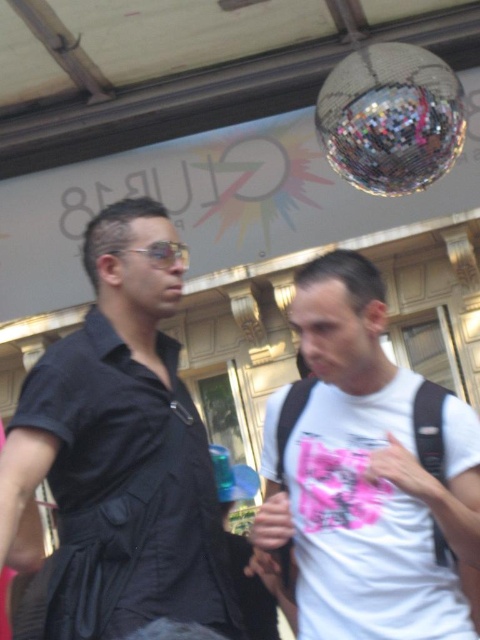
Who is more forward, (360, 525) or (385, 77)?

Point (360, 525) is more forward.

Which is more to the right, white matte t-shirt at center or reflective metallic disco ball at upper center?

Positioned to the right is reflective metallic disco ball at upper center.

Is point (396, 460) farther from camera compared to point (393, 128)?

No, (396, 460) is in front of (393, 128).

At what (x,y) coordinates should I click in order to perform the action: click on white matte t-shirt at center. Please return your answer as a coordinate pair (x, y). The height and width of the screenshot is (640, 480). Looking at the image, I should click on (367, 474).

Is black matte shirt at left below reflective metallic disco ball at upper center?

Yes, black matte shirt at left is below reflective metallic disco ball at upper center.

Between black matte shirt at left and reflective metallic disco ball at upper center, which one has less height?

reflective metallic disco ball at upper center

Who is more distant from viewer, [163,582] or [352,104]?

The point [352,104] is more distant.

Where is `black matte shirt at left`? black matte shirt at left is located at coordinates (120, 451).

Who is higher up, black matte shirt at left or white matte t-shirt at center?

black matte shirt at left is higher up.

Does black matte shirt at left have a greater height compared to white matte t-shirt at center?

Yes, black matte shirt at left is taller than white matte t-shirt at center.

Which is in front, point (86, 332) or point (345, 572)?

Point (345, 572)

Find the location of a particular element. black matte shirt at left is located at coordinates (120, 451).